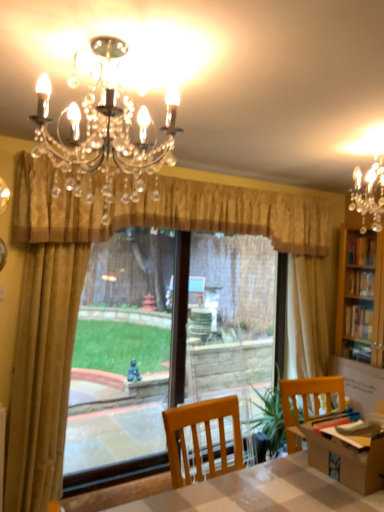
At what (x,y) coordinates should I click in order to perform the action: click on free space above matte black chandelier at upper center (from a real-world perspective). Please return your answer as a coordinate pair (x, y). This screenshot has width=384, height=512. Looking at the image, I should click on (105, 44).